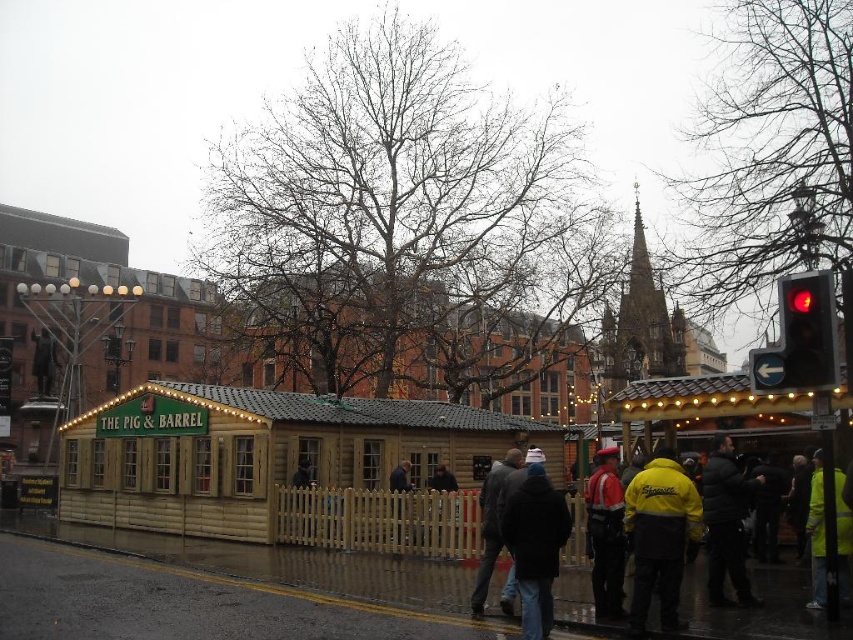
Between point (798, 396) and point (820, 540), which one is positioned in front?

Point (820, 540) is in front.

Who is positioned more to the right, yellow fabric tent at center right or yellow reflective jacket at lower right?

From the viewer's perspective, yellow reflective jacket at lower right appears more on the right side.

Who is more distant from viewer, [809,404] or [815,496]?

Positioned behind is point [809,404].

Find the location of a particular element. The image size is (853, 640). yellow fabric tent at center right is located at coordinates (708, 406).

Where is `wooden cabin at center`? The width and height of the screenshot is (853, 640). wooden cabin at center is located at coordinates (277, 461).

Is point (337, 449) behind point (392, 490)?

That is True.

Identify the location of wooden cabin at center. The width and height of the screenshot is (853, 640). (277, 461).

Does yellow fabric jacket at lower right have a greater width compared to yellow reflective jacket at lower right?

No, yellow fabric jacket at lower right is not wider than yellow reflective jacket at lower right.

Does yellow fabric jacket at lower right have a lesser width compared to yellow reflective jacket at lower right?

Yes, yellow fabric jacket at lower right is thinner than yellow reflective jacket at lower right.

Does point (653, 531) lie in front of point (819, 502)?

Yes.

The width and height of the screenshot is (853, 640). I want to click on yellow fabric jacket at lower right, so [659, 538].